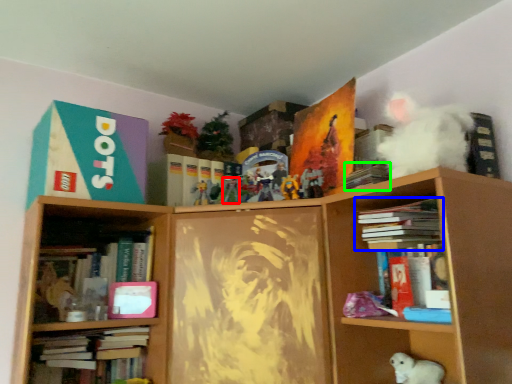
Question: Based on their relative distances, which object is farther from toy (highlighted by a red box)? Choose from book (highlighted by a blue box) and book (highlighted by a green box).

Choices:
 (A) book
 (B) book

Answer: (A)